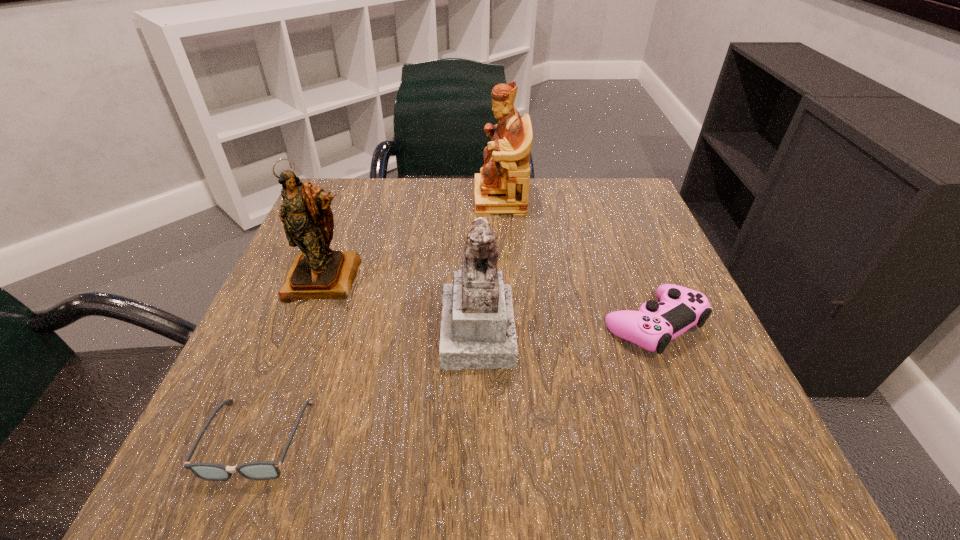
What are the coordinates of `vacant space located on the left of the fourth tallest object` in the screenshot? It's located at (451, 325).

I want to click on object that is positioned at the far edge, so click(x=502, y=187).

Locate an element on the screen. Image resolution: width=960 pixels, height=540 pixels. object that is at the near edge is located at coordinates (260, 470).

This screenshot has width=960, height=540. In order to click on figurine that is at the left edge in this screenshot , I will do `click(317, 272)`.

The height and width of the screenshot is (540, 960). I want to click on spectacles located at the left edge, so click(x=260, y=470).

You are a GUI agent. You are given a task and a screenshot of the screen. Output one action in this format:
    pyautogui.click(x=<x>, y=<y>)
    Task: Click on the object located in the right edge section of the desktop
    The width and height of the screenshot is (960, 540).
    Given the screenshot: What is the action you would take?
    pyautogui.click(x=655, y=324)

Identify the location of object situated at the near left corner. (260, 470).

The image size is (960, 540). Identify the location of free space at the far edge of the desktop. (425, 197).

In the image, there is a desktop. Identify the location of vacant space at the left edge. (362, 239).

Identify the location of free space at the right edge of the desktop. The image size is (960, 540). (740, 395).